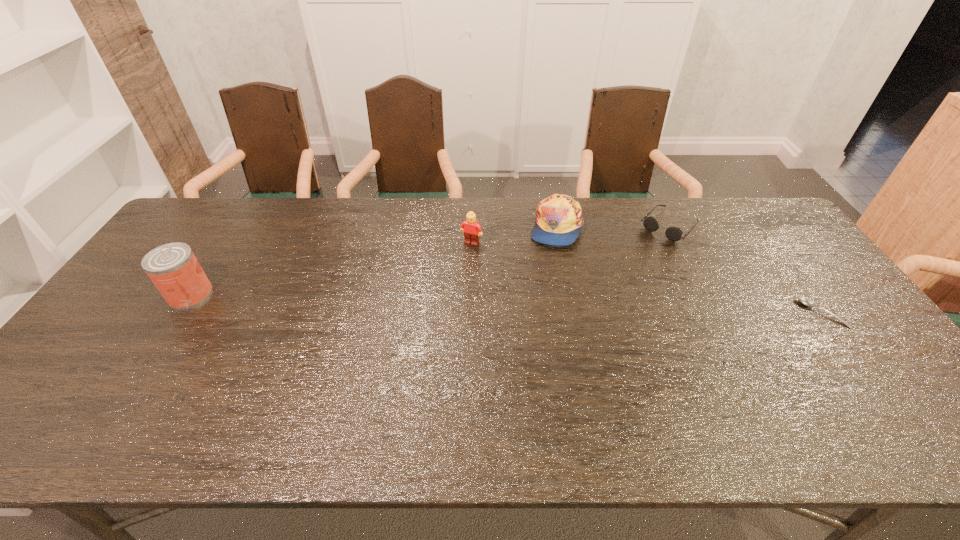
Find the location of a particular element. cap that is at the far edge is located at coordinates (559, 219).

Identify the location of sunglasses situated at the far edge. (674, 234).

Locate an element on the screen. The image size is (960, 540). Lego that is at the far edge is located at coordinates pyautogui.click(x=471, y=229).

What are the coordinates of `object that is positioned at the left edge` in the screenshot? It's located at (173, 268).

Locate an element on the screen. The height and width of the screenshot is (540, 960). object located at the right edge is located at coordinates (805, 301).

Locate an element on the screen. The height and width of the screenshot is (540, 960). vacant area at the far edge is located at coordinates (375, 220).

Where is `vacant space at the near edge of the desktop`? vacant space at the near edge of the desktop is located at coordinates (374, 379).

Locate an element on the screen. The image size is (960, 540). blank space at the left edge is located at coordinates (143, 306).

Where is `free space at the right edge of the desktop`? The width and height of the screenshot is (960, 540). free space at the right edge of the desktop is located at coordinates (809, 286).

This screenshot has width=960, height=540. What are the coordinates of `vacant space at the near left corner of the desktop` in the screenshot? It's located at (109, 395).